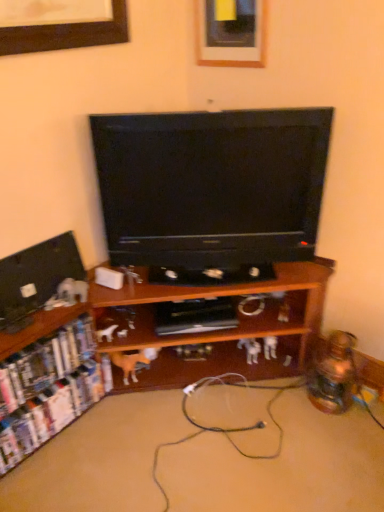
Describe the element at coordinates (48, 389) in the screenshot. The height and width of the screenshot is (512, 384). I see `white cardboard shelf at lower left, positioned as the second shelf in right-to-left order` at that location.

This screenshot has width=384, height=512. What do you see at coordinates (283, 465) in the screenshot?
I see `wooden shelf at lower left` at bounding box center [283, 465].

In the scene shown: What is the approximate width of wooden shelf at center, the second shelf positioned from the left?

The width of wooden shelf at center, the second shelf positioned from the left, is 32.02 inches.

This screenshot has width=384, height=512. Identify the location of white cardboard shelf at lower left, the first shelf positioned from the left. (48, 389).

Is point (236, 61) closer to viewer compared to point (315, 265)?

Yes, it is.

Between matte wooden picture frame at upper center and wooden shelf at center, arranged as the 1th shelf when viewed from the right, which one is positioned in front?

wooden shelf at center, arranged as the 1th shelf when viewed from the right.

From the picture: Is matte wooden picture frame at upper center taller than wooden shelf at center, arranged as the 1th shelf when viewed from the right?

In fact, matte wooden picture frame at upper center may be shorter than wooden shelf at center, arranged as the 1th shelf when viewed from the right.

Can you confirm if matte wooden picture frame at upper center is bigger than wooden shelf at center, the second shelf positioned from the left?

Actually, matte wooden picture frame at upper center might be smaller than wooden shelf at center, the second shelf positioned from the left.

Can you tell me how much matte wooden picture frame at upper center and black rubber extension cord at lower center differ in facing direction?

The angle between the facing direction of matte wooden picture frame at upper center and the facing direction of black rubber extension cord at lower center is 59.2 degrees.

You are a GUI agent. You are given a task and a screenshot of the screen. Output one action in this format:
    pyautogui.click(x=<x>, y=<y>)
    Task: Click on the picture frame on the right of the black rubber extension cord at lower center
    This screenshot has width=384, height=512.
    Given the screenshot: What is the action you would take?
    pyautogui.click(x=231, y=33)

Would you say matte wooden picture frame at upper center is inside or outside black rubber extension cord at lower center?

matte wooden picture frame at upper center is outside black rubber extension cord at lower center.

Is matte wooden picture frame at upper center facing away from black rubber extension cord at lower center?

matte wooden picture frame at upper center is not turned away from black rubber extension cord at lower center.

The width and height of the screenshot is (384, 512). In order to click on extension cord beneath the black glossy television at center (from a real-world perspective) in this screenshot , I will do `click(190, 389)`.

From the picture: Which is in front, black glossy television at center or black rubber extension cord at lower center?

black glossy television at center is in front.

In the scene shown: Does black glossy television at center have a lesser width compared to black rubber extension cord at lower center?

No, black glossy television at center is not thinner than black rubber extension cord at lower center.

Does black glossy television at center have a larger size compared to black rubber extension cord at lower center?

Yes.

Considering the sizes of objects wooden shelf at center, the second shelf positioned from the left, and black rubber extension cord at lower center in the image provided, who is thinner, wooden shelf at center, the second shelf positioned from the left, or black rubber extension cord at lower center?

With smaller width is black rubber extension cord at lower center.

How many degrees apart are the facing directions of wooden shelf at center, the second shelf positioned from the left, and black rubber extension cord at lower center?

The angular difference between wooden shelf at center, the second shelf positioned from the left, and black rubber extension cord at lower center is 34.4 degrees.

Are wooden shelf at center, arranged as the 1th shelf when viewed from the right, and black rubber extension cord at lower center located far from each other?

No, there isn't a large distance between wooden shelf at center, arranged as the 1th shelf when viewed from the right, and black rubber extension cord at lower center.

Considering the sizes of white cardboard shelf at lower left, the first shelf positioned from the left, and wooden shelf at center, arranged as the 1th shelf when viewed from the right, in the image, is white cardboard shelf at lower left, the first shelf positioned from the left, taller or shorter than wooden shelf at center, arranged as the 1th shelf when viewed from the right,?

white cardboard shelf at lower left, the first shelf positioned from the left, is shorter than wooden shelf at center, arranged as the 1th shelf when viewed from the right.

Between white cardboard shelf at lower left, positioned as the second shelf in right-to-left order, and wooden shelf at center, arranged as the 1th shelf when viewed from the right, which one has smaller size?

Smaller between the two is white cardboard shelf at lower left, positioned as the second shelf in right-to-left order.

Considering the relative sizes of white cardboard shelf at lower left, positioned as the second shelf in right-to-left order, and wooden shelf at center, arranged as the 1th shelf when viewed from the right, in the image provided, is white cardboard shelf at lower left, positioned as the second shelf in right-to-left order, thinner than wooden shelf at center, arranged as the 1th shelf when viewed from the right,?

Correct, the width of white cardboard shelf at lower left, positioned as the second shelf in right-to-left order, is less than that of wooden shelf at center, arranged as the 1th shelf when viewed from the right.

Measure the distance between white cardboard shelf at lower left, the first shelf positioned from the left, and wooden shelf at center, the second shelf positioned from the left.

They are 6.37 inches apart.

Considering the positions of points (202, 8) and (76, 404), is point (202, 8) farther from camera compared to point (76, 404)?

No.

Does matte wooden picture frame at upper center have a greater height compared to white cardboard shelf at lower left, positioned as the second shelf in right-to-left order?

Indeed, matte wooden picture frame at upper center has a greater height compared to white cardboard shelf at lower left, positioned as the second shelf in right-to-left order.

Is matte wooden picture frame at upper center far from white cardboard shelf at lower left, the first shelf positioned from the left?

Indeed, matte wooden picture frame at upper center is not near white cardboard shelf at lower left, the first shelf positioned from the left.

Identify the location of the 2nd shelf positioned below the matte wooden picture frame at upper center (from the image's perspective). The width and height of the screenshot is (384, 512). (48, 389).

How many degrees apart are the facing directions of wooden shelf at center, arranged as the 1th shelf when viewed from the right, and wooden shelf at lower left?

3.1 degrees.

Is wooden shelf at center, arranged as the 1th shelf when viewed from the right, positioned with its back to wooden shelf at lower left?

wooden shelf at center, arranged as the 1th shelf when viewed from the right, does not have its back to wooden shelf at lower left.

Based on the photo, does wooden shelf at center, arranged as the 1th shelf when viewed from the right, have a lesser height compared to wooden shelf at lower left?

Incorrect, the height of wooden shelf at center, arranged as the 1th shelf when viewed from the right, does not fall short of that of wooden shelf at lower left.

Is wooden shelf at center, the second shelf positioned from the left, further to the viewer compared to wooden shelf at lower left?

That is False.

This screenshot has height=512, width=384. I want to click on picture frame above the wooden shelf at center, the second shelf positioned from the left (from a real-world perspective), so click(x=231, y=33).

The image size is (384, 512). What are the coordinates of `extension cord behind the matte wooden picture frame at upper center` in the screenshot? It's located at (190, 389).

When comparing their distances from wooden shelf at lower left, does matte wooden picture frame at upper center or white cardboard shelf at lower left, positioned as the second shelf in right-to-left order, seem closer?

white cardboard shelf at lower left, positioned as the second shelf in right-to-left order.

From the image, which object appears to be farther from black glossy television at center, wooden shelf at lower left or wooden shelf at center, the second shelf positioned from the left?

wooden shelf at lower left is further to black glossy television at center.

When comparing their distances from wooden shelf at center, the second shelf positioned from the left, does white cardboard shelf at lower left, the first shelf positioned from the left, or wooden shelf at lower left seem further?

The object further to wooden shelf at center, the second shelf positioned from the left, is wooden shelf at lower left.

From the image, which object appears to be farther from matte wooden picture frame at upper center, wooden shelf at center, arranged as the 1th shelf when viewed from the right, or white cardboard shelf at lower left, the first shelf positioned from the left?

Based on the image, white cardboard shelf at lower left, the first shelf positioned from the left, appears to be further to matte wooden picture frame at upper center.

Looking at the image, which one is located closer to wooden shelf at lower left, white cardboard shelf at lower left, positioned as the second shelf in right-to-left order, or black glossy television at center?

Among the two, white cardboard shelf at lower left, positioned as the second shelf in right-to-left order, is located nearer to wooden shelf at lower left.

When comparing their distances from matte wooden picture frame at upper center, does wooden shelf at lower left or wooden shelf at center, the second shelf positioned from the left, seem further?

Among the two, wooden shelf at lower left is located further to matte wooden picture frame at upper center.

Consider the image. Which object lies nearer to the anchor point wooden shelf at center, arranged as the 1th shelf when viewed from the right, matte wooden picture frame at upper center or white cardboard shelf at lower left, positioned as the second shelf in right-to-left order?

Based on the image, white cardboard shelf at lower left, positioned as the second shelf in right-to-left order, appears to be nearer to wooden shelf at center, arranged as the 1th shelf when viewed from the right.

Based on their spatial positions, is black glossy television at center or wooden shelf at lower left further from black rubber extension cord at lower center?

black glossy television at center.

Identify the location of television between matte wooden picture frame at upper center and black rubber extension cord at lower center in the vertical direction. (211, 186).

Identify the location of extension cord between black glossy television at center and wooden shelf at lower left in the vertical direction. (190, 389).

Where is `extension cord that lies between black glossy television at center and white cardboard shelf at lower left, positioned as the second shelf in right-to-left order, from top to bottom`? This screenshot has width=384, height=512. extension cord that lies between black glossy television at center and white cardboard shelf at lower left, positioned as the second shelf in right-to-left order, from top to bottom is located at coordinates (190, 389).

In order to click on television that lies between matte wooden picture frame at upper center and wooden shelf at center, the second shelf positioned from the left, from top to bottom in this screenshot , I will do `click(211, 186)`.